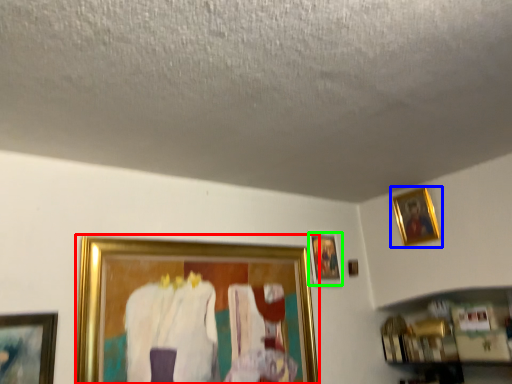
Question: Considering the real-world distances, which object is farthest from picture frame (highlighted by a red box)? picture frame (highlighted by a blue box) or picture frame (highlighted by a green box)?

Choices:
 (A) picture frame
 (B) picture frame

Answer: (A)